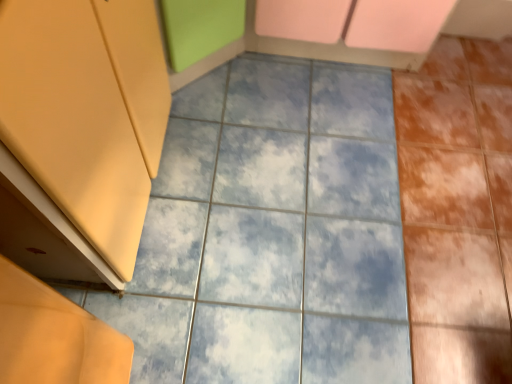
Measure the distance between point (257, 264) and camera.

Point (257, 264) and camera are 4.31 feet apart.

You are a GUI agent. You are given a task and a screenshot of the screen. Output one action in this format:
    pyautogui.click(x=<x>, y=<y>)
    Task: Click on the blue marble tile at center
    The height and width of the screenshot is (384, 512).
    Given the screenshot: What is the action you would take?
    pyautogui.click(x=272, y=233)

Image resolution: width=512 pixels, height=384 pixels. What do you see at coordinates (272, 233) in the screenshot?
I see `blue marble tile at center` at bounding box center [272, 233].

Locate an element on the screen. Image resolution: width=512 pixels, height=384 pixels. matte yellow cabinet at left is located at coordinates (87, 111).

The image size is (512, 384). What do you see at coordinates (87, 111) in the screenshot? I see `matte yellow cabinet at left` at bounding box center [87, 111].

You are a GUI agent. You are given a task and a screenshot of the screen. Output one action in this format:
    pyautogui.click(x=<x>, y=<y>)
    Task: Click on the blue marble tile at center
    This screenshot has width=512, height=384.
    Given the screenshot: What is the action you would take?
    pyautogui.click(x=272, y=233)

Based on the photo, would you say blue marble tile at center is to the left or to the right of matte yellow cabinet at left in the picture?

blue marble tile at center is to the right of matte yellow cabinet at left.

Does blue marble tile at center lie behind matte yellow cabinet at left?

Yes, blue marble tile at center is behind matte yellow cabinet at left.

Which point is more distant from viewer, (384, 283) or (144, 70)?

The point (384, 283) is farther.

From the image's perspective, which object appears higher, blue marble tile at center or matte yellow cabinet at left?

matte yellow cabinet at left appears higher in the image.

From a real-world perspective, is blue marble tile at center positioned under matte yellow cabinet at left based on gravity?

Yes.

Considering the sizes of objects blue marble tile at center and matte yellow cabinet at left in the image provided, who is wider, blue marble tile at center or matte yellow cabinet at left?

With larger width is blue marble tile at center.

In terms of height, does blue marble tile at center look taller or shorter compared to matte yellow cabinet at left?

Clearly, blue marble tile at center is shorter compared to matte yellow cabinet at left.

Consider the image. Does blue marble tile at center have a smaller size compared to matte yellow cabinet at left?

Correct, blue marble tile at center occupies less space than matte yellow cabinet at left.

Would you say blue marble tile at center is outside matte yellow cabinet at left?

Yes, blue marble tile at center is not within matte yellow cabinet at left.

Is blue marble tile at center beside matte yellow cabinet at left?

No, blue marble tile at center is not making contact with matte yellow cabinet at left.

Is blue marble tile at center oriented towards matte yellow cabinet at left?

No, blue marble tile at center is not facing towards matte yellow cabinet at left.

How far apart are blue marble tile at center and matte yellow cabinet at left?

blue marble tile at center and matte yellow cabinet at left are 48.73 centimeters apart from each other.

There is a blue marble tile at center. Where is `cabinetry above it (from a real-world perspective)`? This screenshot has height=384, width=512. cabinetry above it (from a real-world perspective) is located at coordinates (87, 111).

In the scene shown: Visually, is matte yellow cabinet at left positioned to the left or to the right of blue marble tile at center?

Based on their positions, matte yellow cabinet at left is located to the left of blue marble tile at center.

Which is in front, matte yellow cabinet at left or blue marble tile at center?

matte yellow cabinet at left is closer to the camera.

Which is less distant, (1, 60) or (250, 301)?

Point (1, 60) is positioned closer to the camera compared to point (250, 301).

From the image's perspective, is matte yellow cabinet at left on top of blue marble tile at center?

Yes, from the image's perspective, matte yellow cabinet at left is over blue marble tile at center.

From a real-world perspective, who is located lower, matte yellow cabinet at left or blue marble tile at center?

From a 3D spatial view, blue marble tile at center is below.

Is matte yellow cabinet at left thinner than blue marble tile at center?

Answer: Indeed, matte yellow cabinet at left has a lesser width compared to blue marble tile at center.

Who is taller, matte yellow cabinet at left or blue marble tile at center?

Standing taller between the two is matte yellow cabinet at left.

Between matte yellow cabinet at left and blue marble tile at center, which one has smaller size?

blue marble tile at center is smaller.

Would you say matte yellow cabinet at left is outside blue marble tile at center?

That's correct, matte yellow cabinet at left is outside of blue marble tile at center.

In the scene shown: Are matte yellow cabinet at left and blue marble tile at center far apart?

That's not correct — matte yellow cabinet at left is a little close to blue marble tile at center.

Could you tell me if matte yellow cabinet at left is turned towards blue marble tile at center?

Yes.

How many degrees apart are the facing directions of matte yellow cabinet at left and blue marble tile at center?

There is a 0.689-degree angle between the facing directions of matte yellow cabinet at left and blue marble tile at center.

In order to click on ceramic tile below the matte yellow cabinet at left (from a real-world perspective) in this screenshot , I will do `click(272, 233)`.

I want to click on ceramic tile located underneath the matte yellow cabinet at left (from a real-world perspective), so click(x=272, y=233).

You are a GUI agent. You are given a task and a screenshot of the screen. Output one action in this format:
    pyautogui.click(x=<x>, y=<y>)
    Task: Click on the ceramic tile below the matte yellow cabinet at left (from the image's perspective)
    The height and width of the screenshot is (384, 512).
    Given the screenshot: What is the action you would take?
    pyautogui.click(x=272, y=233)